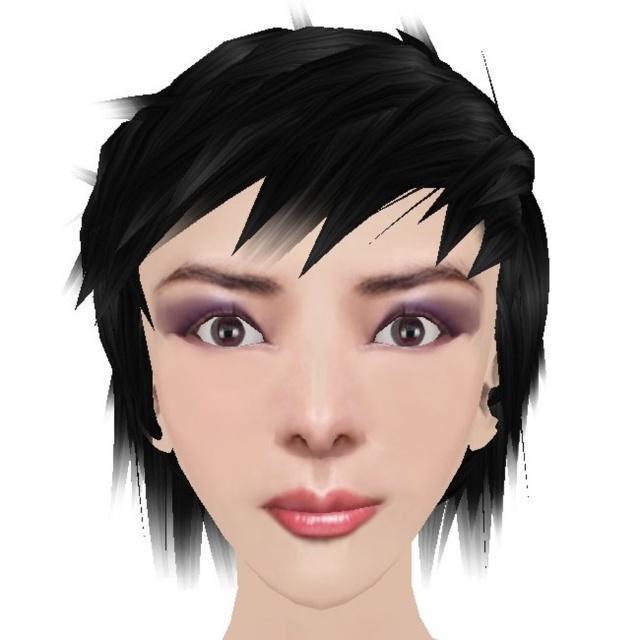
Question: Which object is the closest to the purple glossy eye at center?

Choices:
 (A) dark brown hair at upper center
 (B) smooth skin face at center
 (C) purple matte eye at center
 (D) dark brown eyebrow at upper center

Answer: (D)

Question: Does smooth skin face at center have a smaller size compared to purple matte eye at center?

Choices:
 (A) no
 (B) yes

Answer: (A)

Question: Which of these objects is positioned closest to the dark brown hair at upper center?

Choices:
 (A) smooth skin face at center
 (B) dark brown eyebrow at upper center
 (C) purple matte eye at center
 (D) purple glossy eye at center

Answer: (C)

Question: Does purple glossy eye at center appear on the left side of dark brown eyebrow at upper center?

Choices:
 (A) yes
 (B) no

Answer: (B)

Question: Is dark brown eyebrow at upper center smaller than dark brown hair at upper center?

Choices:
 (A) no
 (B) yes

Answer: (B)

Question: Which point is closer to the camera?

Choices:
 (A) (268, 284)
 (B) (211, 314)
 (C) (392, 321)

Answer: (A)